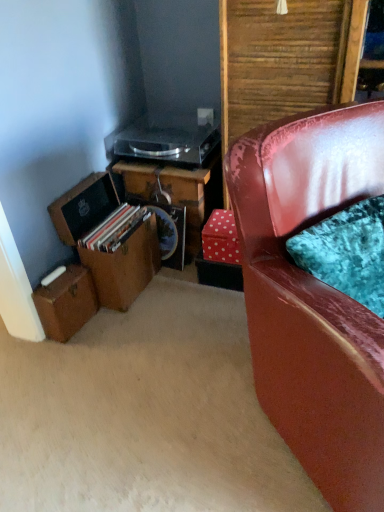
The image size is (384, 512). Identify the location of empty space that is in between brown leather suitcase at lower left, the second box from the bottom, and brown leather suitcase at lower left, which ranks as the 1th box in bottom-to-top order. (97, 324).